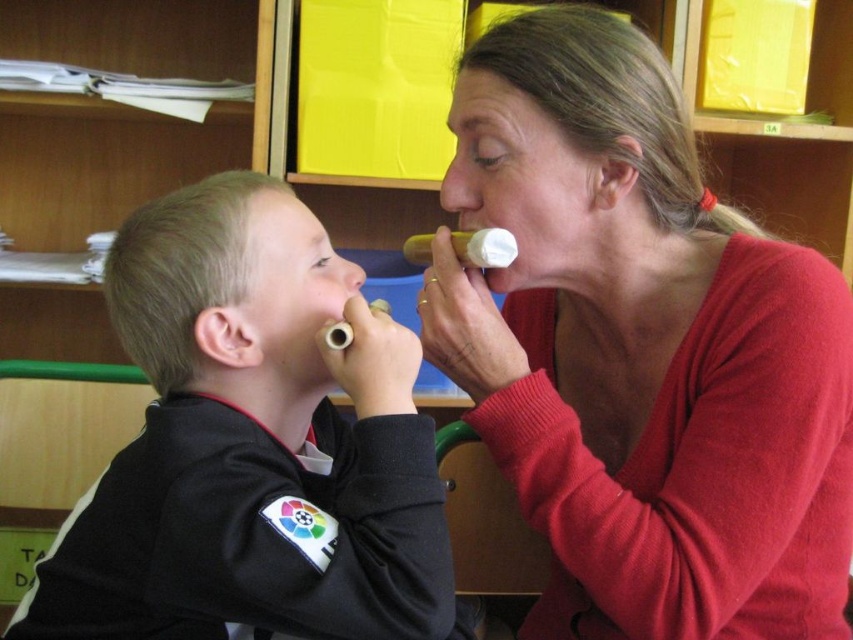
Question: Which is nearer to the smooth skin nose at upper center?

Choices:
 (A) black matte jacket at left
 (B) rubber teething ring at lower center
 (C) matte white flute at center

Answer: (B)

Question: Can you confirm if matte white flute at center is positioned below black matte jacket at left?

Choices:
 (A) no
 (B) yes

Answer: (A)

Question: Can you confirm if smooth skin nose at upper center is positioned to the right of rubber teething ring at lower center?

Choices:
 (A) yes
 (B) no

Answer: (A)

Question: Is matte white flute at center positioned in front of black matte jacket at left?

Choices:
 (A) yes
 (B) no

Answer: (B)

Question: Which point appears closest to the camera in this image?

Choices:
 (A) (440, 192)
 (B) (610, 502)

Answer: (B)

Question: Which point appears closest to the camera in this image?

Choices:
 (A) (496, 449)
 (B) (431, 282)

Answer: (A)